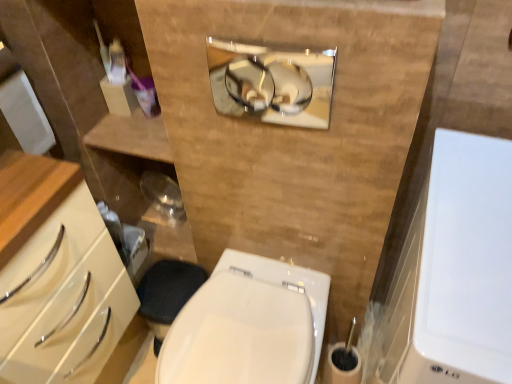
Question: Does white glossy medicine cabinet at right, the 2th medicine cabinet when ordered from back to front, touch white glossy bidet at center?

Choices:
 (A) yes
 (B) no

Answer: (B)

Question: Is white glossy medicine cabinet at right, which is counted as the 1th medicine cabinet, starting from the right, positioned beyond the bounds of white glossy bidet at center?

Choices:
 (A) yes
 (B) no

Answer: (A)

Question: Can you confirm if white glossy medicine cabinet at right, arranged as the first medicine cabinet when ordered from the bottom, is positioned to the right of white glossy bidet at center?

Choices:
 (A) yes
 (B) no

Answer: (A)

Question: From a real-world perspective, is white glossy medicine cabinet at right, marked as the 2th medicine cabinet in a top-to-bottom arrangement, under white glossy bidet at center?

Choices:
 (A) no
 (B) yes

Answer: (A)

Question: Is white glossy medicine cabinet at right, arranged as the first medicine cabinet when ordered from the bottom, looking in the opposite direction of white glossy bidet at center?

Choices:
 (A) no
 (B) yes

Answer: (A)

Question: Can you confirm if white glossy medicine cabinet at right, the second medicine cabinet viewed from the left, is thinner than white glossy bidet at center?

Choices:
 (A) yes
 (B) no

Answer: (B)

Question: Considering the relative sizes of polished chrome mirror at upper center, which is counted as the 2th medicine cabinet, starting from the right, and white glossy bidet at center in the image provided, is polished chrome mirror at upper center, which is counted as the 2th medicine cabinet, starting from the right, taller than white glossy bidet at center?

Choices:
 (A) no
 (B) yes

Answer: (A)

Question: Can you confirm if polished chrome mirror at upper center, which is counted as the second medicine cabinet, starting from the bottom, is shorter than white glossy bidet at center?

Choices:
 (A) no
 (B) yes

Answer: (B)

Question: From the image's perspective, is polished chrome mirror at upper center, which is the 2th medicine cabinet in front-to-back order, located beneath white glossy bidet at center?

Choices:
 (A) yes
 (B) no

Answer: (B)

Question: Is polished chrome mirror at upper center, the first medicine cabinet viewed from the left, wider than white glossy bidet at center?

Choices:
 (A) no
 (B) yes

Answer: (A)

Question: Considering the relative positions of polished chrome mirror at upper center, which appears as the 1th medicine cabinet when viewed from the back, and white glossy bidet at center in the image provided, is polished chrome mirror at upper center, which appears as the 1th medicine cabinet when viewed from the back, to the left of white glossy bidet at center from the viewer's perspective?

Choices:
 (A) yes
 (B) no

Answer: (B)

Question: Is polished chrome mirror at upper center, the 1th medicine cabinet positioned from the top, touching white glossy bidet at center?

Choices:
 (A) yes
 (B) no

Answer: (B)

Question: Could you tell me if white glossy medicine cabinet at right, the second medicine cabinet viewed from the left, is facing polished chrome mirror at upper center, which is counted as the 2th medicine cabinet, starting from the right?

Choices:
 (A) yes
 (B) no

Answer: (B)